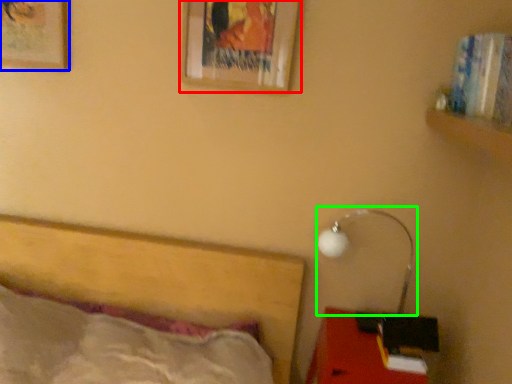
Question: Which object is the farthest from picture frame (highlighted by a red box)? Choose among these: picture frame (highlighted by a blue box) or lamp (highlighted by a green box).

Choices:
 (A) picture frame
 (B) lamp

Answer: (B)